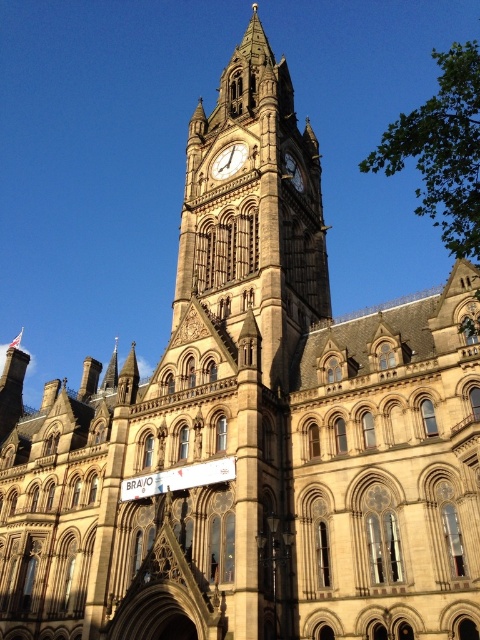
In the scene shown: You are an architect examining the historic building. You notice the brown stone clock tower at center and the gold textured clock at center. Which of these two features is larger in size?

The brown stone clock tower at center is bigger than the gold textured clock at center.

You are standing in front of the historic building and want to take a photo of the gold textured clock at center. However, you notice the brown stone clock tower at center is blocking your view. Is the clock visible from your current position?

The brown stone clock tower at center is above the gold textured clock at center, so the clock is visible below the tower and should be visible from your current position if you position yourself to look under the tower.

You are standing in front of the grand historic building and want to take a photo of the brown stone clock tower at center and the gold textured clock at center. Which object should you focus on first if you want to capture both in one shot without moving the camera?

Answer: The brown stone clock tower at center is closer to the viewer than the gold textured clock at center, so you should focus on the gold textured clock at center first to ensure both are in focus.